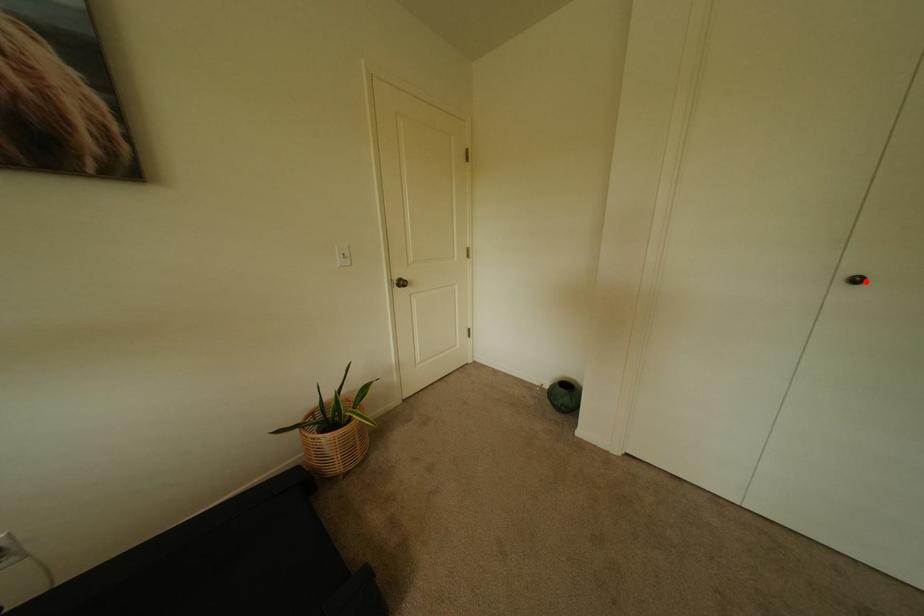
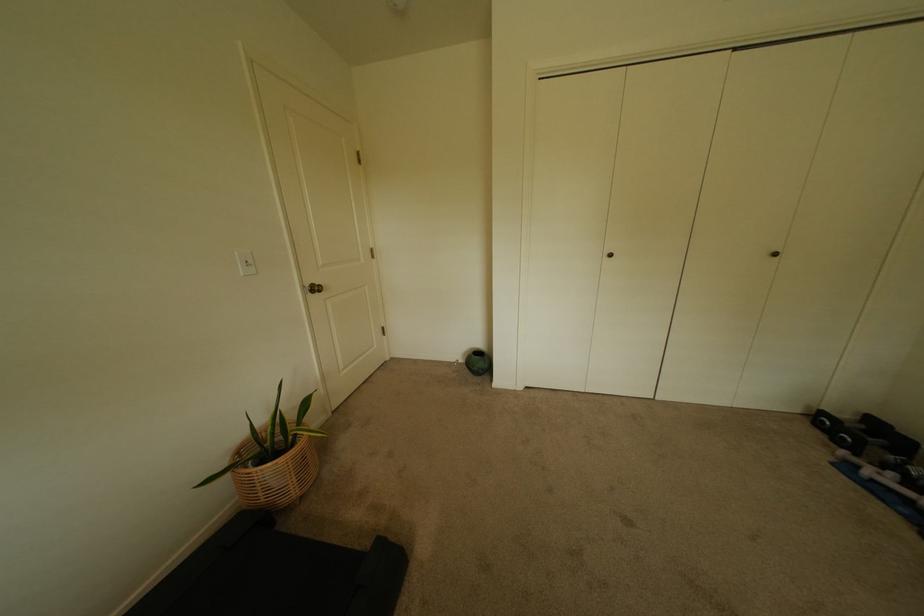
Find the pixel in the second image that matches the highlighted location in the first image.

(618, 256)